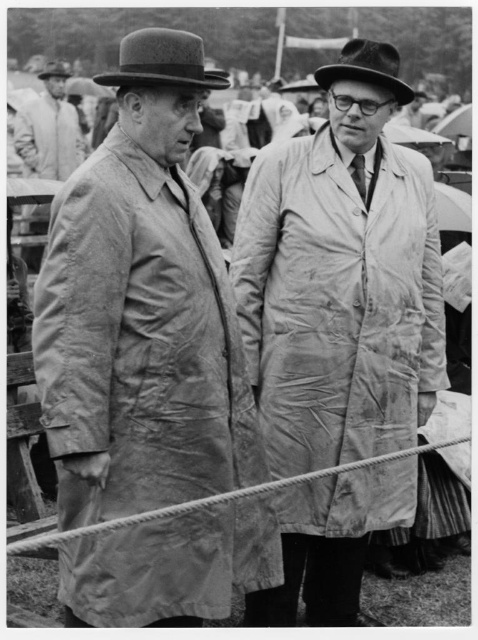
Question: Among these points, which one is nearest to the camera?

Choices:
 (A) (351, 72)
 (B) (378, 412)
 (C) (46, 72)
 (D) (60, 224)

Answer: (D)

Question: Estimate the real-world distances between objects in this image. Which object is closer to the matte gray trench coat at center?

Choices:
 (A) matte brown hat at upper left
 (B) light gray coat at upper left
 (C) matte black hat at upper right
 (D) worn beige fabric raincoat at center

Answer: (D)

Question: Is matte gray trench coat at center further to camera compared to matte black hat at upper left?

Choices:
 (A) yes
 (B) no

Answer: (B)

Question: Does matte gray trench coat at center lie behind matte black hat at upper left?

Choices:
 (A) no
 (B) yes

Answer: (A)

Question: Does worn beige fabric raincoat at center have a lesser width compared to light gray coat at upper left?

Choices:
 (A) no
 (B) yes

Answer: (A)

Question: Which object is the closest to the worn beige fabric raincoat at center?

Choices:
 (A) light gray coat at upper left
 (B) matte gray trench coat at center
 (C) matte black hat at upper right
 (D) matte black hat at upper left

Answer: (B)